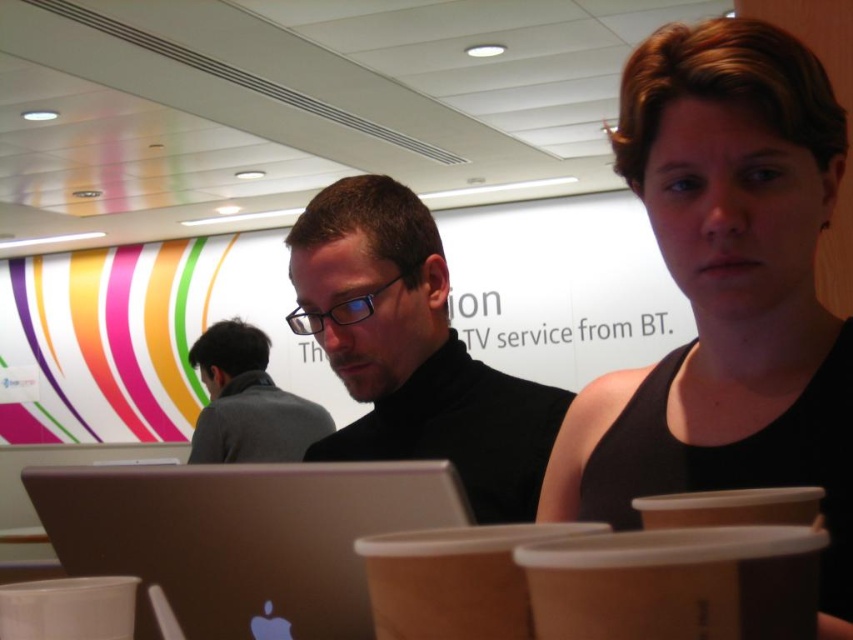
Who is positioned more to the right, gray wool sweater at center or brown paper cup at lower left?

brown paper cup at lower left is more to the right.

Is point (263, 444) positioned behind point (126, 605)?

Yes, point (263, 444) is farther from viewer.

Between point (235, 376) and point (97, 589), which one is positioned behind?

The point (235, 376) is more distant.

The image size is (853, 640). What are the coordinates of `gray wool sweater at center` in the screenshot? It's located at (248, 401).

Between black tank top at center and satin silver laptop at lower left, which one appears on the right side from the viewer's perspective?

Positioned to the right is black tank top at center.

This screenshot has height=640, width=853. What are the coordinates of `black tank top at center` in the screenshot? It's located at (726, 292).

Can you confirm if satin silver laptop at lower left is thinner than gray wool sweater at center?

Indeed, satin silver laptop at lower left has a lesser width compared to gray wool sweater at center.

Describe the element at coordinates (241, 538) in the screenshot. I see `satin silver laptop at lower left` at that location.

At what (x,y) coordinates should I click in order to perform the action: click on satin silver laptop at lower left. Please return your answer as a coordinate pair (x, y). Image resolution: width=853 pixels, height=640 pixels. Looking at the image, I should click on (241, 538).